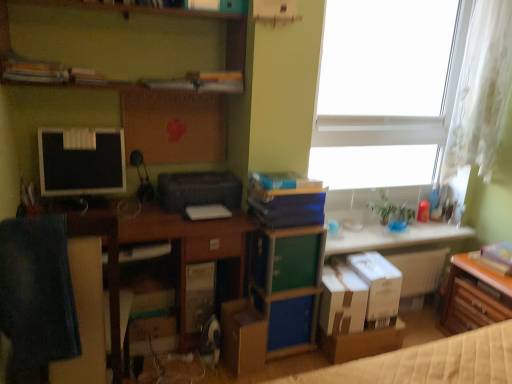
Based on the photo, measure the distance between wooden shelves at upper center and camera.

wooden shelves at upper center is 1.94 meters from camera.

This screenshot has height=384, width=512. Describe the element at coordinates (119, 275) in the screenshot. I see `wooden desk at lower left` at that location.

What do you see at coordinates (395, 237) in the screenshot? I see `white glossy table at center, arranged as the 2th table when ordered from the bottom` at bounding box center [395, 237].

Based on the photo, measure the distance between blue fabric box at center and camera.

blue fabric box at center and camera are 2.25 meters apart from each other.

Identify the location of blue fabric box at center. (290, 322).

Based on the photo, in order to face brown cardboard box at lower right, acting as the 1th cardboard box starting from the right, should I rotate leftwards or rightwards?

You should rotate right by 15.192 degrees.

In order to face green matte file cabinet at center, should I rotate leftwards or rightwards?

To face it directly, rotate right by 3.937 degrees.

Image resolution: width=512 pixels, height=384 pixels. What are the coordinates of `wooden shelves at upper center` in the screenshot? It's located at (127, 38).

Considering the sizes of objects dark blue fabric at left and wooden drawer at lower right, the second table when ordered from top to bottom, in the image provided, who is taller, dark blue fabric at left or wooden drawer at lower right, the second table when ordered from top to bottom,?

With more height is dark blue fabric at left.

Which is more to the left, dark blue fabric at left or wooden drawer at lower right, the 1th table positioned from the bottom?

dark blue fabric at left.

Find the location of a particular element. The height and width of the screenshot is (384, 512). computer chair that appears in front of the wooden drawer at lower right, the 1th table positioned from the bottom is located at coordinates (36, 295).

Does white sheer curtain at upper right have a smaller size compared to wooden desk at lower left?

Yes, white sheer curtain at upper right is smaller than wooden desk at lower left.

What's the angular difference between white sheer curtain at upper right and wooden desk at lower left's facing directions?

The angular difference between white sheer curtain at upper right and wooden desk at lower left is 0.0688 degrees.

Is point (494, 10) closer or farther from the camera than point (181, 246)?

Point (494, 10) appears to be farther away from the viewer than point (181, 246).

Would you say white sheer curtain at upper right is a long distance from wooden desk at lower left?

Yes.

Is brown cardboard box at lower right, which appears as the 4th cardboard box when viewed from the left, facing away from brown cardboard box at center, which is the fourth cardboard box from right to left?

No, brown cardboard box at lower right, which appears as the 4th cardboard box when viewed from the left, is not facing away from brown cardboard box at center, which is the fourth cardboard box from right to left.

Is brown cardboard box at lower right, acting as the 1th cardboard box starting from the right, in contact with brown cardboard box at center, which is the fourth cardboard box from right to left?

There is a gap between brown cardboard box at lower right, acting as the 1th cardboard box starting from the right, and brown cardboard box at center, which is the fourth cardboard box from right to left.

From a real-world perspective, is brown cardboard box at lower right, which appears as the 4th cardboard box when viewed from the left, physically located above or below brown cardboard box at center, arranged as the 1th cardboard box when viewed from the left?

Clearly, from a real-world perspective, brown cardboard box at lower right, which appears as the 4th cardboard box when viewed from the left, is above brown cardboard box at center, arranged as the 1th cardboard box when viewed from the left.

In terms of width, does brown cardboard box at lower right, acting as the 1th cardboard box starting from the right, look wider or thinner when compared to brown cardboard box at center, which is the fourth cardboard box from right to left?

Clearly, brown cardboard box at lower right, acting as the 1th cardboard box starting from the right, has more width compared to brown cardboard box at center, which is the fourth cardboard box from right to left.

From the image's perspective, is blue matte book at center, acting as the second book starting from the top, under brown cardboard box at center, which is the fourth cardboard box from right to left?

No, from the image's perspective, blue matte book at center, acting as the second book starting from the top, is not beneath brown cardboard box at center, which is the fourth cardboard box from right to left.

Does blue matte book at center, the 3th book in the bottom-to-top sequence, appear on the right side of brown cardboard box at center, which is the fourth cardboard box from right to left?

Correct, you'll find blue matte book at center, the 3th book in the bottom-to-top sequence, to the right of brown cardboard box at center, which is the fourth cardboard box from right to left.

Does blue matte book at center, which appears as the 1th book when viewed from the right, turn towards brown cardboard box at center, which is the fourth cardboard box from right to left?

No, blue matte book at center, which appears as the 1th book when viewed from the right, is not aimed at brown cardboard box at center, which is the fourth cardboard box from right to left.

In order to click on cardboard box on the left of blue matte book at center, which appears as the 1th book when viewed from the right in this screenshot , I will do `click(242, 337)`.

From a real-world perspective, between white cardboard box at lower center, the second cardboard box when ordered from right to left, and hardcover book at upper left, which appears as the fourth book when viewed from the right, who is vertically lower?

white cardboard box at lower center, the second cardboard box when ordered from right to left, from a real-world perspective.

Is white cardboard box at lower center, the third cardboard box viewed from the left, spatially inside hardcover book at upper left, which is the 4th book from bottom to top, or outside of it?

white cardboard box at lower center, the third cardboard box viewed from the left, exists outside the volume of hardcover book at upper left, which is the 4th book from bottom to top.

Considering the positions of objects white cardboard box at lower center, the second cardboard box when ordered from right to left, and hardcover book at upper left, marked as the 1th book in a top-to-bottom arrangement, in the image provided, who is more to the left, white cardboard box at lower center, the second cardboard box when ordered from right to left, or hardcover book at upper left, marked as the 1th book in a top-to-bottom arrangement,?

Positioned to the left is hardcover book at upper left, marked as the 1th book in a top-to-bottom arrangement.

Is blue matte book at center, acting as the second book starting from the top, at the right side of white matte book at center, the 3th book from the right?

Indeed, blue matte book at center, acting as the second book starting from the top, is positioned on the right side of white matte book at center, the 3th book from the right.

Which object is more forward, blue matte book at center, placed as the 4th book when sorted from left to right, or white matte book at center, the 3th book from the right?

blue matte book at center, placed as the 4th book when sorted from left to right, is more forward.

Which of these two, blue matte book at center, which appears as the 1th book when viewed from the right, or white matte book at center, acting as the 4th book starting from the top, is wider?

blue matte book at center, which appears as the 1th book when viewed from the right.

Is blue matte book at center, the 3th book in the bottom-to-top sequence, wider or thinner than blue fabric box at center?

Considering their sizes, blue matte book at center, the 3th book in the bottom-to-top sequence, looks broader than blue fabric box at center.

Considering the positions of point (296, 185) and point (308, 339), is point (296, 185) closer or farther from the camera than point (308, 339)?

Point (296, 185) is closer to the camera than point (308, 339).

Locate an element on the screen. The width and height of the screenshot is (512, 384). the 3rd book above the blue fabric box at center (from a real-world perspective) is located at coordinates (283, 181).

How different are the orientations of blue matte book at center, the 3th book in the bottom-to-top sequence, and blue fabric box at center in degrees?

There is a 0.000506-degree angle between the facing directions of blue matte book at center, the 3th book in the bottom-to-top sequence, and blue fabric box at center.

From a real-world perspective, count 2nd tables downward from the dark blue fabric at left and point to it. Please provide its 2D coordinates.

[(474, 297)]

Where is `curtain positioned vertically above the wooden desk at lower left (from a real-world perspective)`? curtain positioned vertically above the wooden desk at lower left (from a real-world perspective) is located at coordinates (481, 90).

When comparing their distances from brown cardboard box at lower right, acting as the 1th cardboard box starting from the right, does white cardboard box at center, the 3th cardboard box viewed from the right, or white glossy table at center, arranged as the 2th table when ordered from the bottom, seem further?

white glossy table at center, arranged as the 2th table when ordered from the bottom, lies further to brown cardboard box at lower right, acting as the 1th cardboard box starting from the right, than the other object.

Looking at the image, which one is located further to wooden desk at lower left, white cardboard box at lower center, the second cardboard box when ordered from right to left, or metallic silver storage box at center?

Based on the image, white cardboard box at lower center, the second cardboard box when ordered from right to left, appears to be further to wooden desk at lower left.

When comparing their distances from metallic silver storage box at center, does blue hardcover book at center, placed as the third book when sorted from top to bottom, or white sheer curtain at upper right seem further?

Based on the image, white sheer curtain at upper right appears to be further to metallic silver storage box at center.

Looking at the image, which one is located further to metallic silver storage box at center, blue matte book at center, placed as the 4th book when sorted from left to right, or dark blue fabric at left?

dark blue fabric at left.

Looking at the image, which one is located closer to blue fabric box at center, blue matte book at center, acting as the second book starting from the top, or black plastic printer at center?

blue matte book at center, acting as the second book starting from the top, lies closer to blue fabric box at center than the other object.

In the scene shown: When comparing their distances from white glossy table at center, arranged as the 2th table when ordered from the bottom, does green matte file cabinet at center or blue hardcover book at center, placed as the third book when sorted from top to bottom, seem closer?

green matte file cabinet at center lies closer to white glossy table at center, arranged as the 2th table when ordered from the bottom, than the other object.

When comparing their distances from metallic silver storage box at center, does white sheer curtain at upper right or white cardboard box at lower center, the third cardboard box viewed from the left, seem closer?

The object closer to metallic silver storage box at center is white cardboard box at lower center, the third cardboard box viewed from the left.

Considering their positions, is white cardboard box at center, the 3th cardboard box viewed from the right, positioned closer to white matte window at upper right than white sheer curtain at upper right?

white sheer curtain at upper right lies closer to white matte window at upper right than the other object.

You are a GUI agent. You are given a task and a screenshot of the screen. Output one action in this format:
    pyautogui.click(x=<x>, y=<y>)
    Task: Click on the box that lies between white matte book at center, arranged as the 2th book when viewed from the left, and brown cardboard box at center, which is the fourth cardboard box from right to left, from top to bottom
    The width and height of the screenshot is (512, 384).
    Given the screenshot: What is the action you would take?
    290,322

Identify the location of box that lies between blue matte book at center, the 3th book in the bottom-to-top sequence, and brown cardboard box at center, arranged as the 1th cardboard box when viewed from the left, from top to bottom. Image resolution: width=512 pixels, height=384 pixels. (290, 322).

This screenshot has width=512, height=384. I want to click on printer between matte black monitor at left and white glossy table at center, arranged as the 2th table when ordered from the bottom, so click(198, 190).

Identify the location of file cabinet between matte black monitor at left and wooden drawer at lower right, the 1th table positioned from the bottom, from left to right. (289, 286).